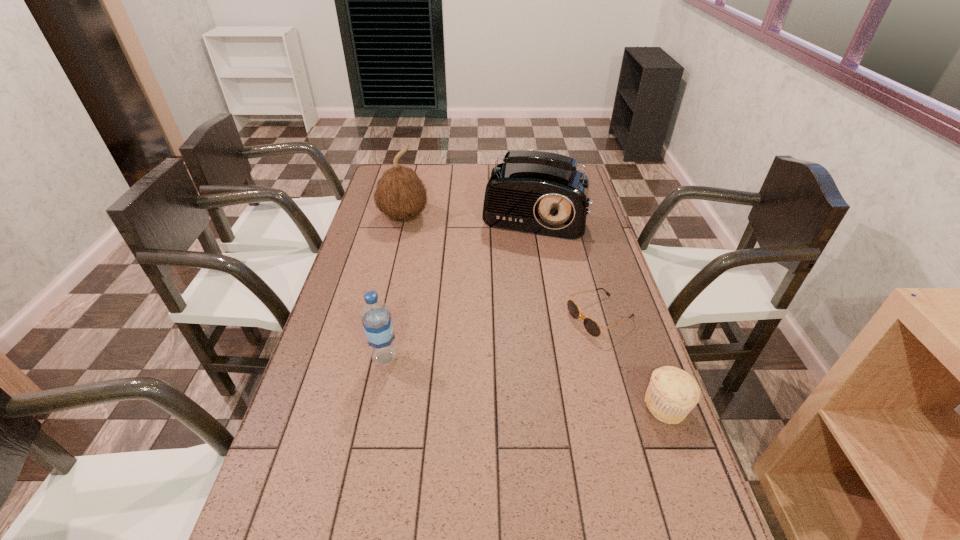
I want to click on water bottle present at the left edge, so click(x=376, y=318).

Locate an element on the screen. The width and height of the screenshot is (960, 540). coconut that is at the left edge is located at coordinates click(x=400, y=194).

Locate an element on the screen. muffin situated at the right edge is located at coordinates (672, 393).

The height and width of the screenshot is (540, 960). What are the coordinates of `radio receiver at the right edge` in the screenshot? It's located at (536, 192).

I want to click on sunglasses at the right edge, so click(x=591, y=326).

Identify the location of object located in the far right corner section of the desktop. The image size is (960, 540). (536, 192).

The width and height of the screenshot is (960, 540). I want to click on vacant space at the far edge of the desktop, so click(x=444, y=170).

Locate an element on the screen. The height and width of the screenshot is (540, 960). vacant space at the near edge of the desktop is located at coordinates (492, 522).

You are a GUI agent. You are given a task and a screenshot of the screen. Output one action in this format:
    pyautogui.click(x=<x>, y=<y>)
    Task: Click on the free space at the left edge of the desktop
    The height and width of the screenshot is (540, 960).
    Given the screenshot: What is the action you would take?
    pyautogui.click(x=331, y=374)

Where is `free point at the right edge`? free point at the right edge is located at coordinates (645, 407).